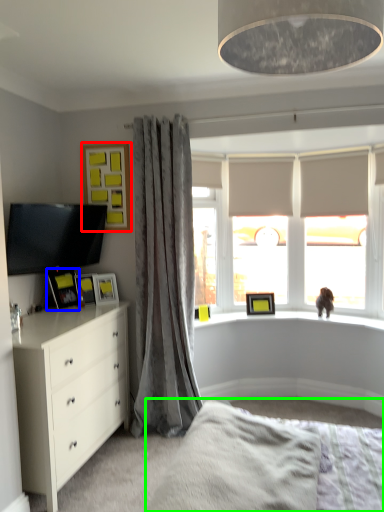
Question: Estimate the real-world distances between objects in this image. Which object is closer to picture frame (highlighted by a red box), picture frame (highlighted by a blue box) or bed frame (highlighted by a green box)?

Choices:
 (A) picture frame
 (B) bed frame

Answer: (A)